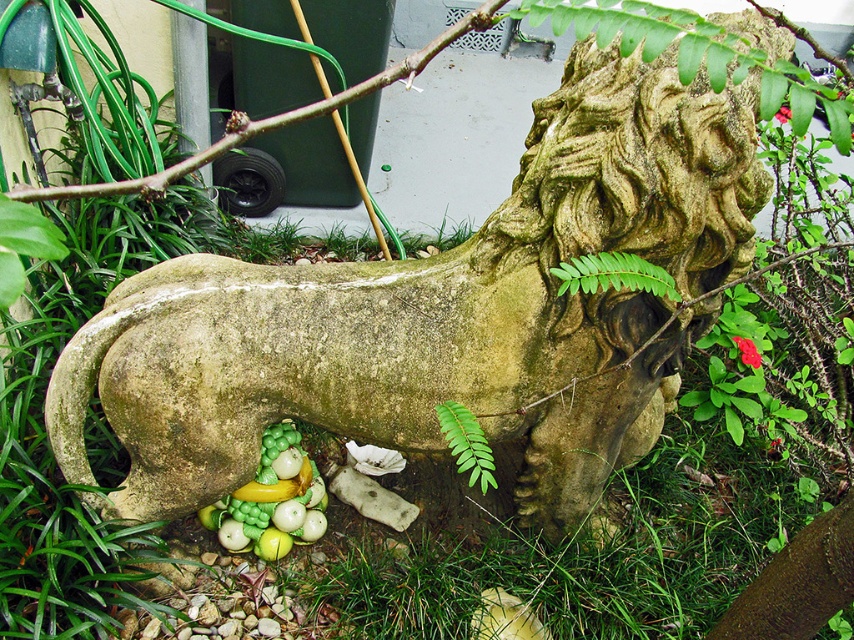
Question: Is green stone lion at center in front of green matte fruit at lower center?

Choices:
 (A) no
 (B) yes

Answer: (B)

Question: Can you confirm if green stone lion at center is positioned above green matte flower at lower right?

Choices:
 (A) yes
 (B) no

Answer: (B)

Question: Can you confirm if green matte fruit at lower center is smaller than red matte flower at upper right?

Choices:
 (A) no
 (B) yes

Answer: (B)

Question: Which point appears farthest from the camera in this image?

Choices:
 (A) (484, 444)
 (B) (779, 109)
 (C) (609, 138)
 (D) (736, 346)

Answer: (D)

Question: Which point is farther to the camera?

Choices:
 (A) green leafy fern at lower center
 (B) green matte flower at lower right
 (C) green stone lion at center
 (D) red matte flower at upper right

Answer: (B)

Question: Considering the real-world distances, which object is closest to the red matte flower at upper right?

Choices:
 (A) green leafy fern at lower center
 (B) green matte fruit at lower center
 (C) green matte flower at lower right
 (D) green stone lion at center

Answer: (C)